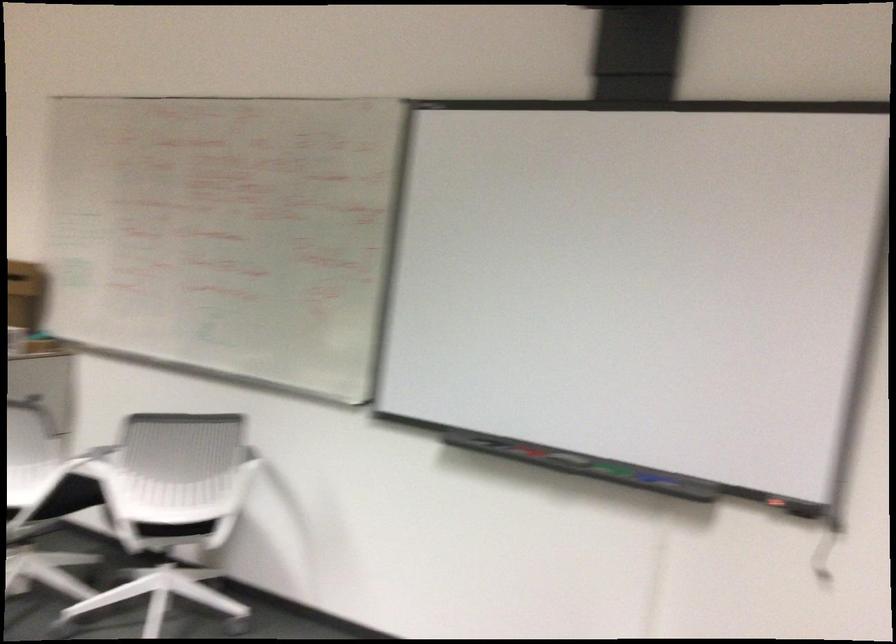
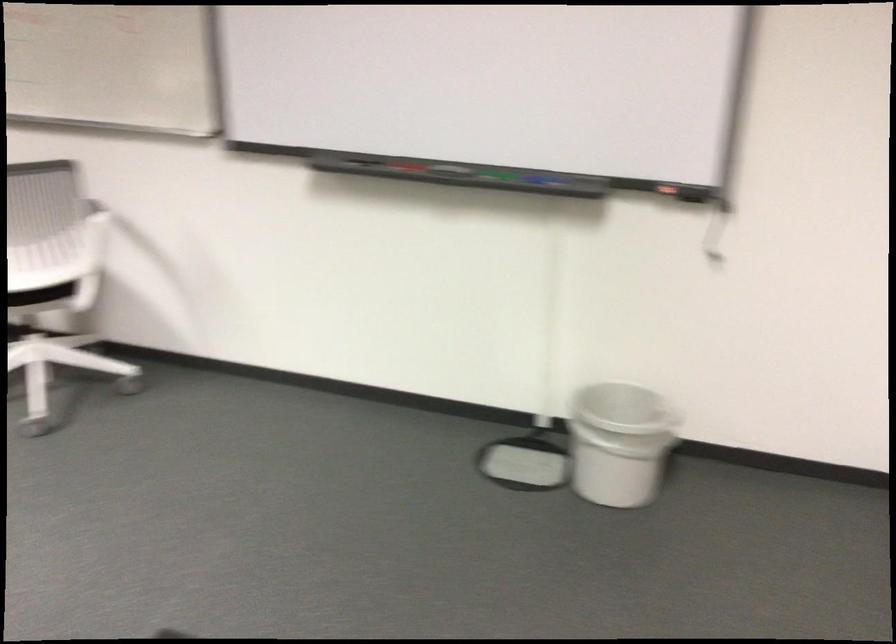
In the second image, find the point that corresponds to (x=181, y=527) in the first image.

(40, 295)